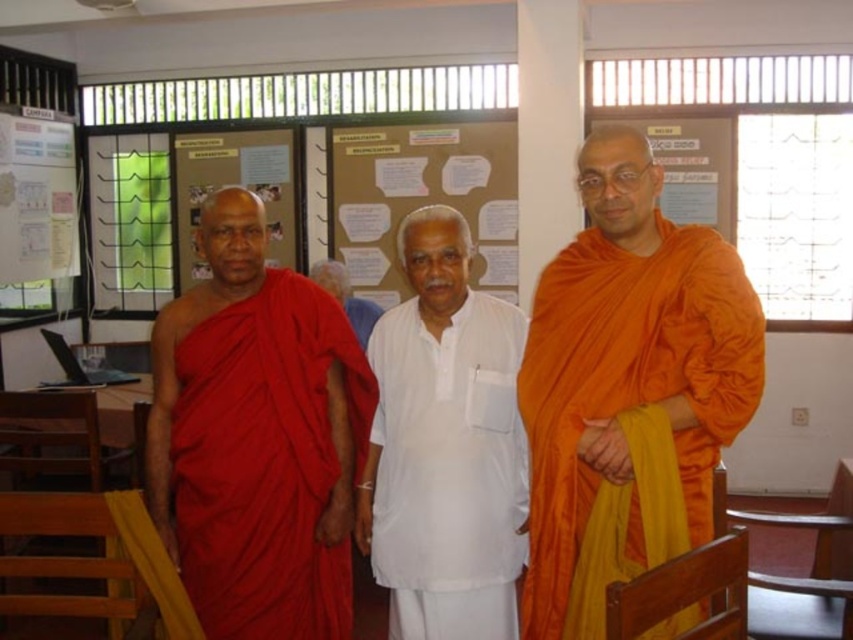
Question: In this image, where is matte red robe at center located relative to white cotton kurta at center?

Choices:
 (A) right
 (B) left

Answer: (B)

Question: Is matte red robe at center to the left of white cotton shirt at center from the viewer's perspective?

Choices:
 (A) no
 (B) yes

Answer: (B)

Question: Which of the following is the farthest from the observer?

Choices:
 (A) (605, 317)
 (B) (349, 589)
 (C) (361, 323)
 (D) (491, 417)

Answer: (C)

Question: Which point is closer to the camera?

Choices:
 (A) white cotton shirt at center
 (B) white cotton kurta at center
 (C) orange silk robe at center

Answer: (C)

Question: Does orange silk robe at center have a lesser width compared to white cotton kurta at center?

Choices:
 (A) no
 (B) yes

Answer: (A)

Question: Which object appears farthest from the camera in this image?

Choices:
 (A) matte red robe at center
 (B) white cotton shirt at center
 (C) orange silk robe at center

Answer: (B)